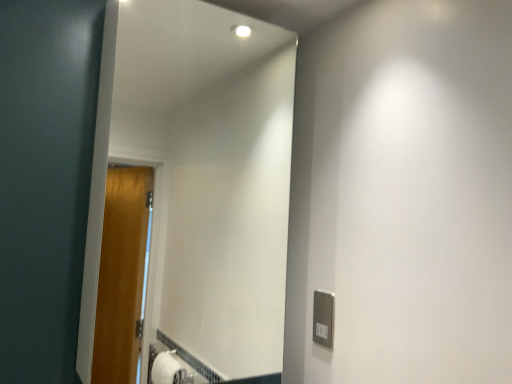
Question: In the image, is white plastic outlet at lower right positioned in front of or behind white glossy mirror at center?

Choices:
 (A) front
 (B) behind

Answer: (B)

Question: Is white plastic outlet at lower right inside the boundaries of white glossy mirror at center, or outside?

Choices:
 (A) inside
 (B) outside

Answer: (B)

Question: Would you say white plastic outlet at lower right is to the left or to the right of white glossy mirror at center in the picture?

Choices:
 (A) right
 (B) left

Answer: (A)

Question: Do you think white glossy mirror at center is within white plastic outlet at lower right, or outside of it?

Choices:
 (A) inside
 (B) outside

Answer: (B)

Question: From the image's perspective, is white glossy mirror at center located above or below white plastic outlet at lower right?

Choices:
 (A) below
 (B) above

Answer: (B)

Question: Is white glossy mirror at center wider or thinner than white plastic outlet at lower right?

Choices:
 (A) thin
 (B) wide

Answer: (B)

Question: In terms of size, does white glossy mirror at center appear bigger or smaller than white plastic outlet at lower right?

Choices:
 (A) small
 (B) big

Answer: (B)